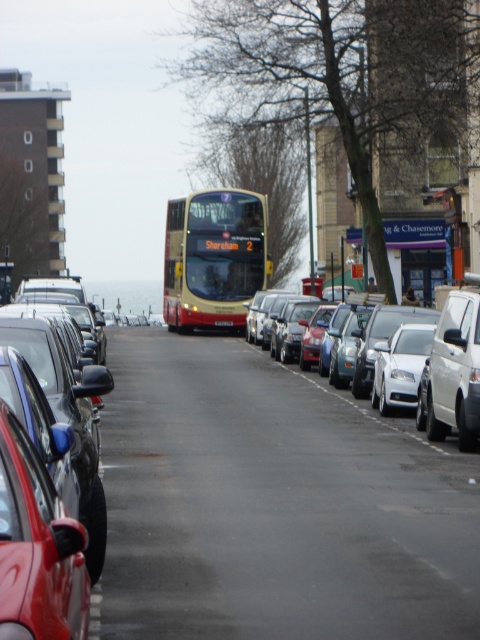
Question: Is shiny black car at left smaller than white glossy car at center?

Choices:
 (A) yes
 (B) no

Answer: (B)

Question: Does shiny black car at left have a lesser width compared to gold metallic bus at center?

Choices:
 (A) yes
 (B) no

Answer: (B)

Question: Which point is closer to the camera?

Choices:
 (A) (230, 321)
 (B) (58, 387)

Answer: (B)

Question: Which object appears farthest from the camera in this image?

Choices:
 (A) white glossy car at center
 (B) shiny black car at left
 (C) gold/yellow metallic bus at center
 (D) gold metallic bus at center

Answer: (D)

Question: Which of these objects is positioned closest to the gold metallic bus at center?

Choices:
 (A) white glossy car at center
 (B) gold/yellow metallic bus at center

Answer: (B)

Question: Is gold/yellow metallic bus at center smaller than white glossy car at center?

Choices:
 (A) no
 (B) yes

Answer: (A)